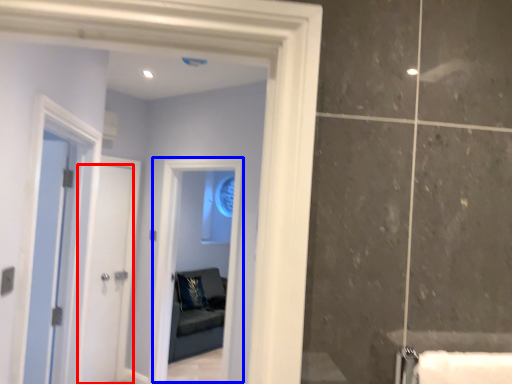
Question: Which of the following is the farthest to the observer, door (highlighted by a red box) or window (highlighted by a blue box)?

Choices:
 (A) door
 (B) window

Answer: (A)